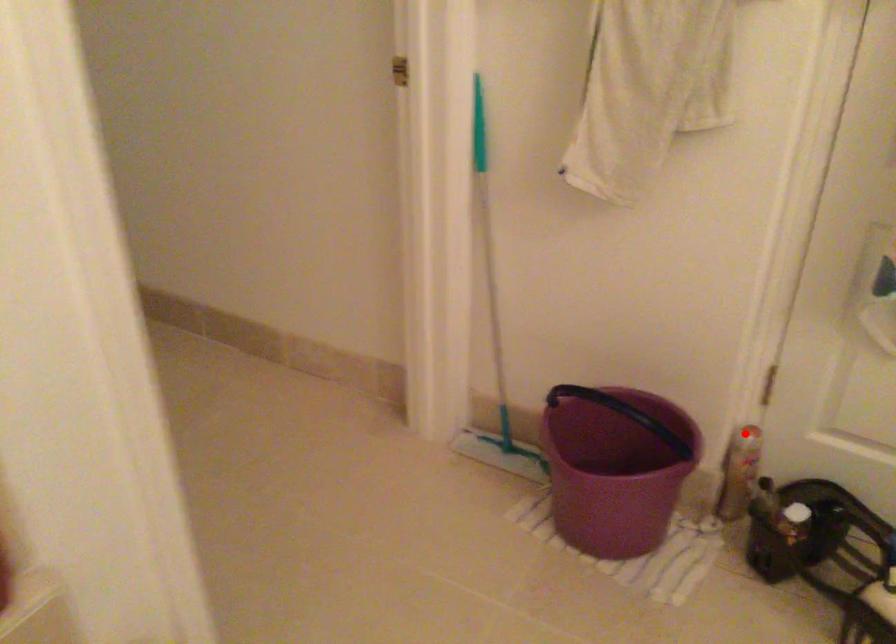
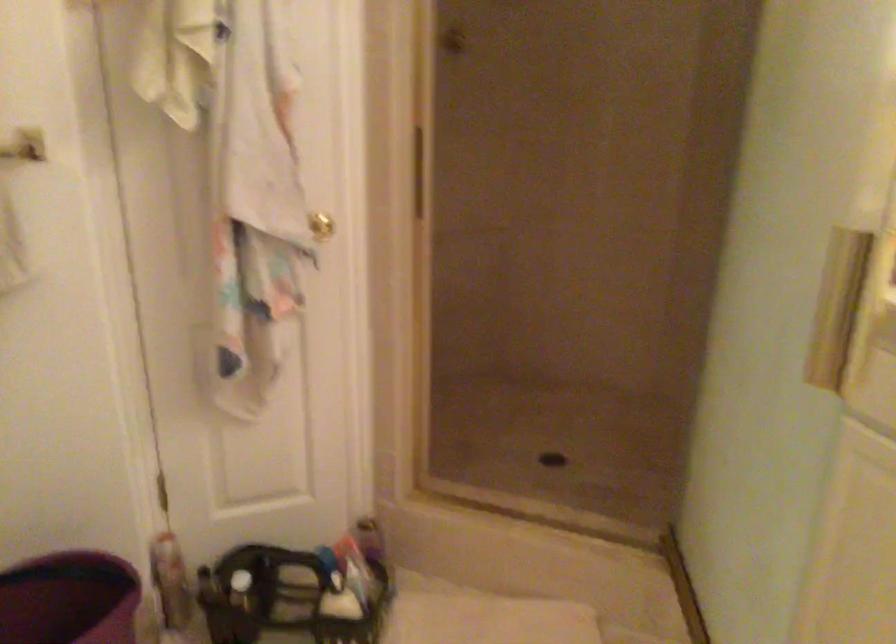
In the second image, find the point that corresponds to the highlighted location in the first image.

(165, 545)